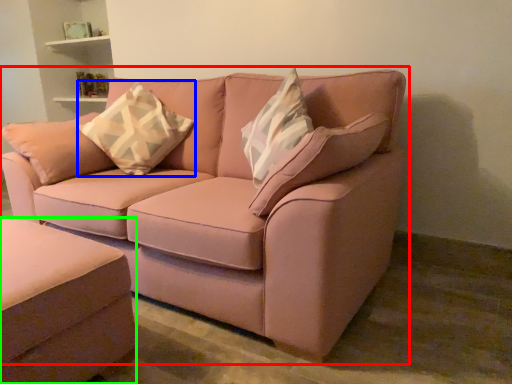
Question: Considering the real-world distances, which object is closest to studio couch (highlighted by a red box)? throw pillow (highlighted by a blue box) or studio couch (highlighted by a green box).

Choices:
 (A) throw pillow
 (B) studio couch

Answer: (A)